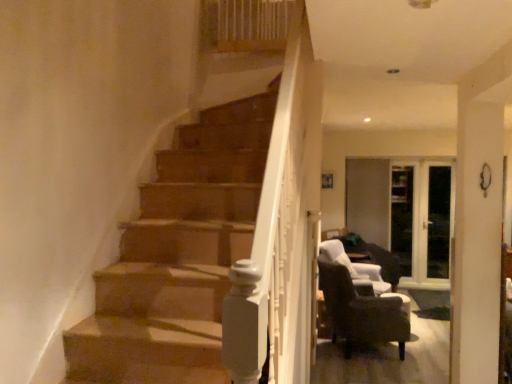
You are a GUI agent. You are given a task and a screenshot of the screen. Output one action in this format:
    pyautogui.click(x=<x>, y=<y>)
    Task: Click on the transparent glass door at center, which is counted as the 1th glass door, starting from the left
    The width and height of the screenshot is (512, 384).
    Given the screenshot: What is the action you would take?
    pyautogui.click(x=422, y=223)

This screenshot has height=384, width=512. In order to click on dark brown leather armchair at lower right, the 1th chair in the front-to-back sequence in this screenshot , I will do `click(362, 311)`.

Is dark brown leather armchair at lower right, the 1th chair in the front-to-back sequence, outside of transparent glass door at center, which appears as the second glass door when viewed from the right?

dark brown leather armchair at lower right, the 1th chair in the front-to-back sequence, is positioned outside transparent glass door at center, which appears as the second glass door when viewed from the right.

From a real-world perspective, which is physically below, dark brown leather armchair at lower right, the 1th chair in the front-to-back sequence, or transparent glass door at center, which appears as the second glass door when viewed from the right?

From a 3D spatial view, dark brown leather armchair at lower right, the 1th chair in the front-to-back sequence, is below.

Considering the sizes of objects dark brown leather armchair at lower right, arranged as the second chair when viewed from the back, and transparent glass door at center, which is counted as the 1th glass door, starting from the left, in the image provided, who is smaller, dark brown leather armchair at lower right, arranged as the second chair when viewed from the back, or transparent glass door at center, which is counted as the 1th glass door, starting from the left,?

transparent glass door at center, which is counted as the 1th glass door, starting from the left, is smaller.

Considering the relative sizes of dark brown leather armchair at lower right, the 1th chair in the front-to-back sequence, and transparent glass door at center, which is counted as the 1th glass door, starting from the left, in the image provided, is dark brown leather armchair at lower right, the 1th chair in the front-to-back sequence, taller than transparent glass door at center, which is counted as the 1th glass door, starting from the left,?

No, dark brown leather armchair at lower right, the 1th chair in the front-to-back sequence, is not taller than transparent glass door at center, which is counted as the 1th glass door, starting from the left.

Can we say dark brown leather armchair at lower right, the 1th chair in the front-to-back sequence, lies outside transparent glass door at right, which is the first glass door in right-to-left order?

dark brown leather armchair at lower right, the 1th chair in the front-to-back sequence, is positioned outside transparent glass door at right, which is the first glass door in right-to-left order.

Based on the photo, from a real-world perspective, is dark brown leather armchair at lower right, arranged as the second chair when viewed from the back, positioned above or below transparent glass door at right, which is the first glass door in right-to-left order?

dark brown leather armchair at lower right, arranged as the second chair when viewed from the back, is below transparent glass door at right, which is the first glass door in right-to-left order.

Is dark brown leather armchair at lower right, arranged as the second chair when viewed from the back, bigger than transparent glass door at right, positioned as the second glass door in left-to-right order?

Indeed, dark brown leather armchair at lower right, arranged as the second chair when viewed from the back, has a larger size compared to transparent glass door at right, positioned as the second glass door in left-to-right order.

There is a transparent glass door at center, which is counted as the 1th glass door, starting from the left. Identify the location of the 2nd chair below it (from a real-world perspective). The width and height of the screenshot is (512, 384). (353, 266).

Is dark brown leather chair at lower right, placed as the first chair when sorted from back to front, located outside transparent glass door at center, which is counted as the 1th glass door, starting from the left?

Indeed, dark brown leather chair at lower right, placed as the first chair when sorted from back to front, is completely outside transparent glass door at center, which is counted as the 1th glass door, starting from the left.

From the image's perspective, which one is positioned higher, dark brown leather chair at lower right, which is the second chair from front to back, or transparent glass door at center, which is counted as the 1th glass door, starting from the left?

From the image's view, transparent glass door at center, which is counted as the 1th glass door, starting from the left, is above.

From a real-world perspective, is transparent glass door at right, which is the first glass door in right-to-left order, physically below dark brown leather chair at lower right, placed as the first chair when sorted from back to front?

Incorrect, from a real-world perspective, transparent glass door at right, which is the first glass door in right-to-left order, is higher than dark brown leather chair at lower right, placed as the first chair when sorted from back to front.

From the image's perspective, is transparent glass door at right, positioned as the second glass door in left-to-right order, under dark brown leather chair at lower right, which is the second chair from front to back?

No, from the image's perspective, transparent glass door at right, positioned as the second glass door in left-to-right order, is not below dark brown leather chair at lower right, which is the second chair from front to back.

Can you confirm if transparent glass door at right, which is the first glass door in right-to-left order, is shorter than dark brown leather chair at lower right, placed as the first chair when sorted from back to front?

No.

Considering the sizes of transparent glass door at right, positioned as the second glass door in left-to-right order, and dark brown leather chair at lower right, which is the second chair from front to back, in the image, is transparent glass door at right, positioned as the second glass door in left-to-right order, bigger or smaller than dark brown leather chair at lower right, which is the second chair from front to back,?

In the image, transparent glass door at right, positioned as the second glass door in left-to-right order, appears to be smaller than dark brown leather chair at lower right, which is the second chair from front to back.

Considering the sizes of objects transparent glass door at right, which is the first glass door in right-to-left order, and transparent glass door at center, which is counted as the 1th glass door, starting from the left, in the image provided, who is shorter, transparent glass door at right, which is the first glass door in right-to-left order, or transparent glass door at center, which is counted as the 1th glass door, starting from the left,?

With less height is transparent glass door at center, which is counted as the 1th glass door, starting from the left.

Could you tell me if transparent glass door at right, positioned as the second glass door in left-to-right order, is turned towards transparent glass door at center, which appears as the second glass door when viewed from the right?

Yes, transparent glass door at right, positioned as the second glass door in left-to-right order, is turned towards transparent glass door at center, which appears as the second glass door when viewed from the right.

Could transparent glass door at center, which is counted as the 1th glass door, starting from the left, be considered to be inside transparent glass door at right, positioned as the second glass door in left-to-right order?

No, transparent glass door at center, which is counted as the 1th glass door, starting from the left, is not inside transparent glass door at right, positioned as the second glass door in left-to-right order.

Between point (404, 263) and point (413, 238), which one is positioned behind?

The point (404, 263) is farther from the camera.

From the image's perspective, which one is positioned lower, dark brown leather chair at lower right, which is the second chair from front to back, or transparent glass door at right, positioned as the second glass door in left-to-right order?

From the image's view, dark brown leather chair at lower right, which is the second chair from front to back, is below.

Is dark brown leather chair at lower right, placed as the first chair when sorted from back to front, placed right next to transparent glass door at right, positioned as the second glass door in left-to-right order?

No, dark brown leather chair at lower right, placed as the first chair when sorted from back to front, is not beside transparent glass door at right, positioned as the second glass door in left-to-right order.

From a real-world perspective, who is located higher, dark brown leather chair at lower right, placed as the first chair when sorted from back to front, or transparent glass door at right, which is the first glass door in right-to-left order?

transparent glass door at right, which is the first glass door in right-to-left order.

From the image's perspective, starting from the dark brown leather armchair at lower right, arranged as the second chair when viewed from the back, which glass door is the 1st one above? Please provide its 2D coordinates.

[(422, 223)]

How distant is transparent glass door at center, which appears as the second glass door when viewed from the right, from dark brown leather armchair at lower right, arranged as the second chair when viewed from the back?

2.47 meters.

Considering the sizes of objects transparent glass door at center, which appears as the second glass door when viewed from the right, and dark brown leather armchair at lower right, arranged as the second chair when viewed from the back, in the image provided, who is smaller, transparent glass door at center, which appears as the second glass door when viewed from the right, or dark brown leather armchair at lower right, arranged as the second chair when viewed from the back,?

transparent glass door at center, which appears as the second glass door when viewed from the right.

Is point (448, 276) positioned before point (408, 332)?

No, (448, 276) is further to viewer.

Which glass door is the 1st one when counting from the back of the dark brown leather armchair at lower right, arranged as the second chair when viewed from the back? Please provide its 2D coordinates.

[(422, 223)]

You are a GUI agent. You are given a task and a screenshot of the screen. Output one action in this format:
    pyautogui.click(x=<x>, y=<y>)
    Task: Click on the 2nd glass door above the dark brown leather armchair at lower right, the 1th chair in the front-to-back sequence (from a real-world perspective)
    Image resolution: width=512 pixels, height=384 pixels.
    Given the screenshot: What is the action you would take?
    pyautogui.click(x=402, y=216)

Looking at the image, which one is located closer to dark brown leather chair at lower right, which is the second chair from front to back, transparent glass door at right, which is the first glass door in right-to-left order, or dark brown leather armchair at lower right, the 1th chair in the front-to-back sequence?

The object closer to dark brown leather chair at lower right, which is the second chair from front to back, is dark brown leather armchair at lower right, the 1th chair in the front-to-back sequence.

Estimate the real-world distances between objects in this image. Which object is closer to dark brown leather armchair at lower right, arranged as the second chair when viewed from the back, transparent glass door at right, positioned as the second glass door in left-to-right order, or transparent glass door at center, which appears as the second glass door when viewed from the right?

Answer: transparent glass door at center, which appears as the second glass door when viewed from the right.

From the picture: Which object lies nearer to the anchor point dark brown leather armchair at lower right, the 1th chair in the front-to-back sequence, dark brown leather chair at lower right, which is the second chair from front to back, or transparent glass door at center, which appears as the second glass door when viewed from the right?

dark brown leather chair at lower right, which is the second chair from front to back, is closer to dark brown leather armchair at lower right, the 1th chair in the front-to-back sequence.

Which object lies nearer to the anchor point transparent glass door at right, which is the first glass door in right-to-left order, dark brown leather armchair at lower right, arranged as the second chair when viewed from the back, or transparent glass door at center, which is counted as the 1th glass door, starting from the left?

Among the two, transparent glass door at center, which is counted as the 1th glass door, starting from the left, is located nearer to transparent glass door at right, which is the first glass door in right-to-left order.

Looking at the image, which one is located further to dark brown leather chair at lower right, which is the second chair from front to back, dark brown leather armchair at lower right, arranged as the second chair when viewed from the back, or transparent glass door at center, which appears as the second glass door when viewed from the right?

Among the two, transparent glass door at center, which appears as the second glass door when viewed from the right, is located further to dark brown leather chair at lower right, which is the second chair from front to back.

Which object lies further to the anchor point transparent glass door at center, which is counted as the 1th glass door, starting from the left, dark brown leather armchair at lower right, arranged as the second chair when viewed from the back, or transparent glass door at right, which is the first glass door in right-to-left order?

Based on the image, dark brown leather armchair at lower right, arranged as the second chair when viewed from the back, appears to be further to transparent glass door at center, which is counted as the 1th glass door, starting from the left.

Considering their positions, is dark brown leather chair at lower right, which is the second chair from front to back, positioned closer to transparent glass door at right, positioned as the second glass door in left-to-right order, than transparent glass door at center, which appears as the second glass door when viewed from the right?

transparent glass door at center, which appears as the second glass door when viewed from the right, is closer to transparent glass door at right, positioned as the second glass door in left-to-right order.

Which object lies further to the anchor point transparent glass door at center, which is counted as the 1th glass door, starting from the left, dark brown leather chair at lower right, which is the second chair from front to back, or transparent glass door at right, which is the first glass door in right-to-left order?

dark brown leather chair at lower right, which is the second chair from front to back, is positioned further to the anchor transparent glass door at center, which is counted as the 1th glass door, starting from the left.

Identify the location of chair between dark brown leather armchair at lower right, arranged as the second chair when viewed from the back, and transparent glass door at right, which is the first glass door in right-to-left order, from front to back. (353, 266).

Where is `glass door positioned between dark brown leather armchair at lower right, the 1th chair in the front-to-back sequence, and transparent glass door at right, positioned as the second glass door in left-to-right order, from near to far`? This screenshot has width=512, height=384. glass door positioned between dark brown leather armchair at lower right, the 1th chair in the front-to-back sequence, and transparent glass door at right, positioned as the second glass door in left-to-right order, from near to far is located at coordinates (422, 223).

Locate an element on the screen. This screenshot has height=384, width=512. chair between dark brown leather armchair at lower right, the 1th chair in the front-to-back sequence, and transparent glass door at center, which is counted as the 1th glass door, starting from the left, in the front-back direction is located at coordinates (353, 266).

What are the coordinates of `glass door located between dark brown leather chair at lower right, placed as the first chair when sorted from back to front, and transparent glass door at right, which is the first glass door in right-to-left order, in the depth direction` in the screenshot? It's located at (422, 223).